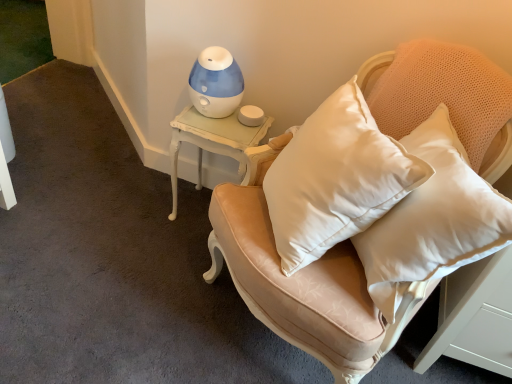
What do you see at coordinates (212, 142) in the screenshot? The width and height of the screenshot is (512, 384). I see `white painted wood side table at upper left` at bounding box center [212, 142].

I want to click on blue plastic humidifier at upper center, so click(x=215, y=83).

Considering the relative sizes of white painted wood side table at upper left and satin beige armchair at center in the image provided, is white painted wood side table at upper left shorter than satin beige armchair at center?

Indeed, white painted wood side table at upper left has a lesser height compared to satin beige armchair at center.

Does point (253, 141) appear closer or farther from the camera than point (322, 262)?

Point (253, 141) appears to be farther away from the viewer than point (322, 262).

Which of these two, white painted wood side table at upper left or satin beige armchair at center, is wider?

satin beige armchair at center.

From the picture: Does white painted wood side table at upper left appear on the right side of satin beige armchair at center?

In fact, white painted wood side table at upper left is to the left of satin beige armchair at center.

Is blue plastic humidifier at upper center surrounding satin beige armchair at center?

No, satin beige armchair at center is not a part of blue plastic humidifier at upper center.

Is blue plastic humidifier at upper center in front of or behind satin beige armchair at center in the image?

blue plastic humidifier at upper center is positioned farther from the viewer than satin beige armchair at center.

Is point (232, 78) farther from viewer compared to point (412, 51)?

Yes, point (232, 78) is farther from viewer.

Which of these two, blue plastic humidifier at upper center or satin beige armchair at center, stands shorter?

With less height is blue plastic humidifier at upper center.

Is satin beige armchair at center wider than white painted wood side table at upper left?

Indeed, satin beige armchair at center has a greater width compared to white painted wood side table at upper left.

From a real-world perspective, is satin beige armchair at center below white painted wood side table at upper left?

Actually, satin beige armchair at center is physically above white painted wood side table at upper left in the real world.

Is point (469, 69) behind point (186, 124)?

No, (469, 69) is in front of (186, 124).

What's the angular difference between satin beige armchair at center and white painted wood side table at upper left's facing directions?

They differ by 29.1 degrees in their facing directions.

The width and height of the screenshot is (512, 384). I want to click on furniture that appears below the blue plastic humidifier at upper center (from the image's perspective), so click(x=293, y=278).

Is satin beige armchair at center with blue plastic humidifier at upper center?

No, satin beige armchair at center is not touching blue plastic humidifier at upper center.

Is satin beige armchair at center oriented away from blue plastic humidifier at upper center?

No, satin beige armchair at center is not facing the opposite direction of blue plastic humidifier at upper center.

Does white painted wood side table at upper left have a lesser width compared to blue plastic humidifier at upper center?

No.

From the picture: From a real-world perspective, is white painted wood side table at upper left located beneath blue plastic humidifier at upper center?

Yes, from a real-world perspective, white painted wood side table at upper left is under blue plastic humidifier at upper center.

Could you tell me if white painted wood side table at upper left is facing blue plastic humidifier at upper center?

No, white painted wood side table at upper left does not turn towards blue plastic humidifier at upper center.

Between point (248, 142) and point (218, 60), which one is positioned in front?

Positioned in front is point (218, 60).

Would you say blue plastic humidifier at upper center is inside or outside white painted wood side table at upper left?

blue plastic humidifier at upper center is outside white painted wood side table at upper left.

Considering the sizes of objects blue plastic humidifier at upper center and white painted wood side table at upper left in the image provided, who is thinner, blue plastic humidifier at upper center or white painted wood side table at upper left?

blue plastic humidifier at upper center.

Between blue plastic humidifier at upper center and white painted wood side table at upper left, which one has more height?

white painted wood side table at upper left is taller.

Locate an element on the screen. This screenshot has width=512, height=384. table below the blue plastic humidifier at upper center (from a real-world perspective) is located at coordinates (212, 142).

Identify the location of furniture lying in front of the white painted wood side table at upper left. (293, 278).

I want to click on furniture below the blue plastic humidifier at upper center (from the image's perspective), so click(x=293, y=278).

Looking at the image, which one is located further to white painted wood side table at upper left, satin beige armchair at center or blue plastic humidifier at upper center?

satin beige armchair at center lies further to white painted wood side table at upper left than the other object.

When comparing their distances from satin beige armchair at center, does white painted wood side table at upper left or blue plastic humidifier at upper center seem further?

blue plastic humidifier at upper center is further to satin beige armchair at center.

From the image, which object appears to be nearer to blue plastic humidifier at upper center, white painted wood side table at upper left or satin beige armchair at center?

Among the two, white painted wood side table at upper left is located nearer to blue plastic humidifier at upper center.

Based on their spatial positions, is satin beige armchair at center or white painted wood side table at upper left further from blue plastic humidifier at upper center?

satin beige armchair at center lies further to blue plastic humidifier at upper center than the other object.

Estimate the real-world distances between objects in this image. Which object is further from satin beige armchair at center, blue plastic humidifier at upper center or white painted wood side table at upper left?

Based on the image, blue plastic humidifier at upper center appears to be further to satin beige armchair at center.

Considering their positions, is blue plastic humidifier at upper center positioned further to white painted wood side table at upper left than satin beige armchair at center?

Among the two, satin beige armchair at center is located further to white painted wood side table at upper left.

Where is `table lamp between satin beige armchair at center and white painted wood side table at upper left in the front-back direction`? The height and width of the screenshot is (384, 512). table lamp between satin beige armchair at center and white painted wood side table at upper left in the front-back direction is located at coordinates (215, 83).